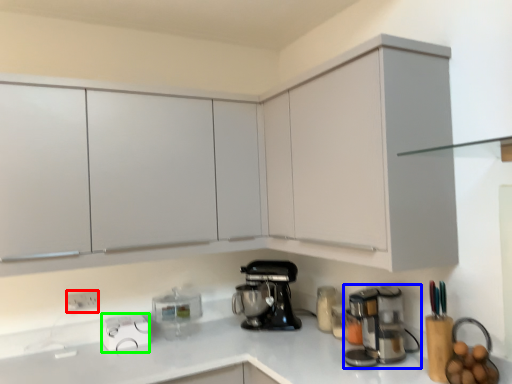
Question: Which is nearer to the electric outlet (highlighted by a red box)? home appliance (highlighted by a blue box) or appliance (highlighted by a green box).

Choices:
 (A) home appliance
 (B) appliance

Answer: (B)